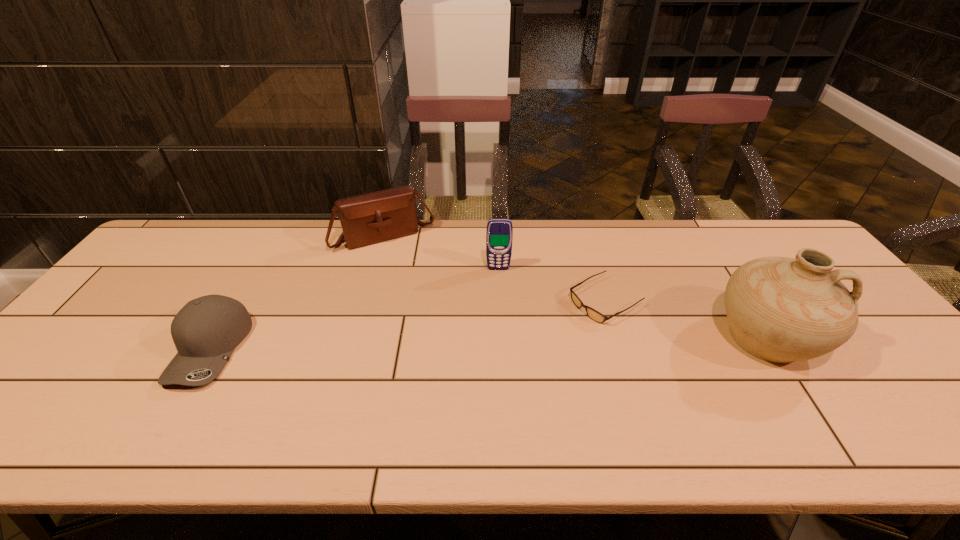
I want to click on free spot on the desktop that is between the baseball cap and the pottery and is positioned on the front-facing side of the second farthest object, so click(501, 343).

Locate an element on the screen. free space on the desktop that is between the leftmost object and the tallest object and is positioned on the front-facing side of the second object from right to left is located at coordinates (532, 342).

Where is `free space on the desktop that is between the leftmost object and the pottery and is positioned on the front flap of the farthest object`? This screenshot has width=960, height=540. free space on the desktop that is between the leftmost object and the pottery and is positioned on the front flap of the farthest object is located at coordinates (440, 344).